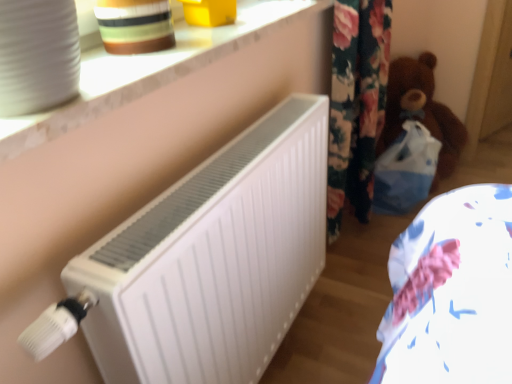
Question: In the image, is brown plush teddy bear at right on the left side or the right side of striped ceramic pot at upper left?

Choices:
 (A) left
 (B) right

Answer: (B)

Question: From their relative heights in the image, would you say brown plush teddy bear at right is taller or shorter than striped ceramic pot at upper left?

Choices:
 (A) short
 (B) tall

Answer: (B)

Question: Considering the real-world distances, which object is farthest from the white marble window sill at upper center?

Choices:
 (A) white matte radiator at center
 (B) brown plush teddy bear at right
 (C) striped ceramic pot at upper left

Answer: (B)

Question: Which of these objects is positioned closest to the striped ceramic pot at upper left?

Choices:
 (A) white marble window sill at upper center
 (B) brown plush teddy bear at right
 (C) white matte radiator at center

Answer: (A)